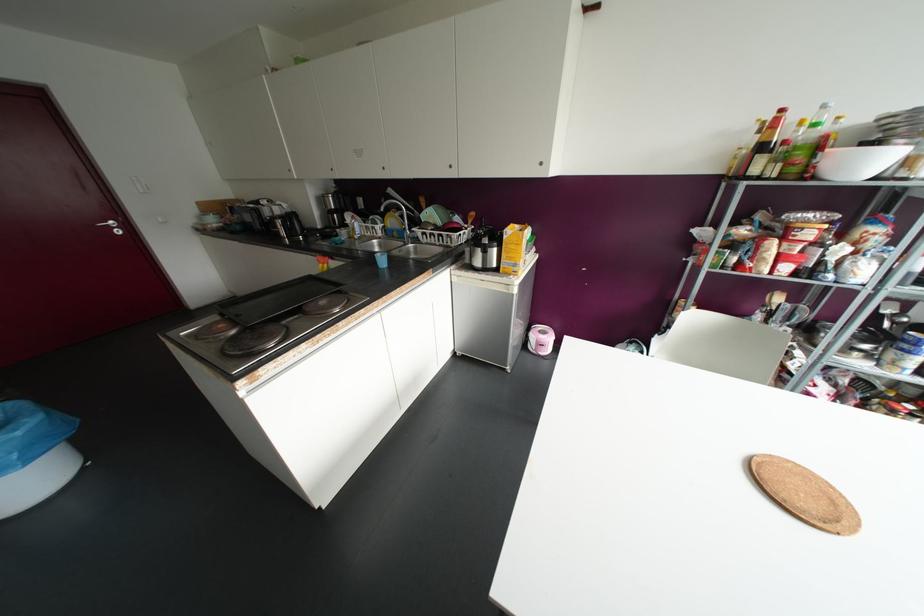
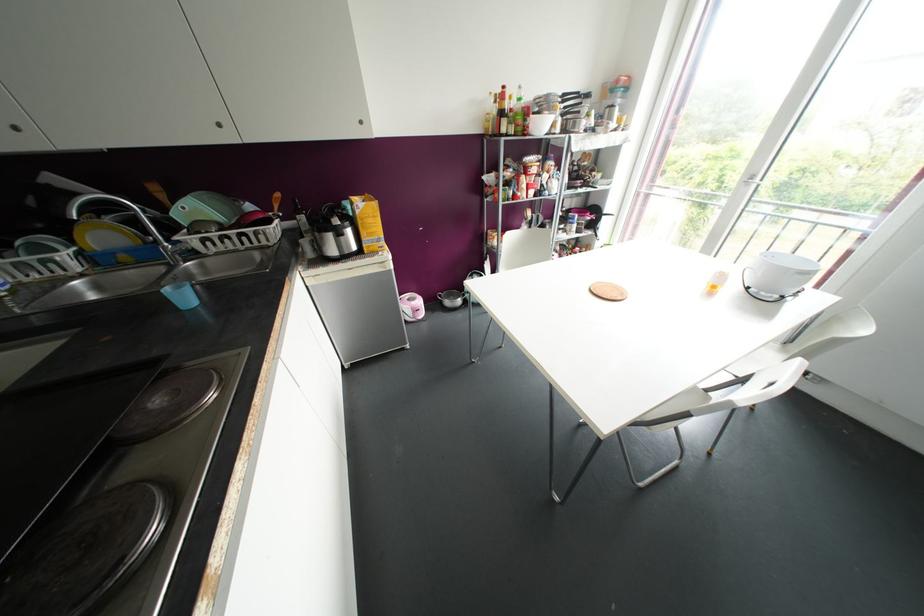
In the second image, find the point that corresponds to pixel 541 334 in the first image.

(412, 302)